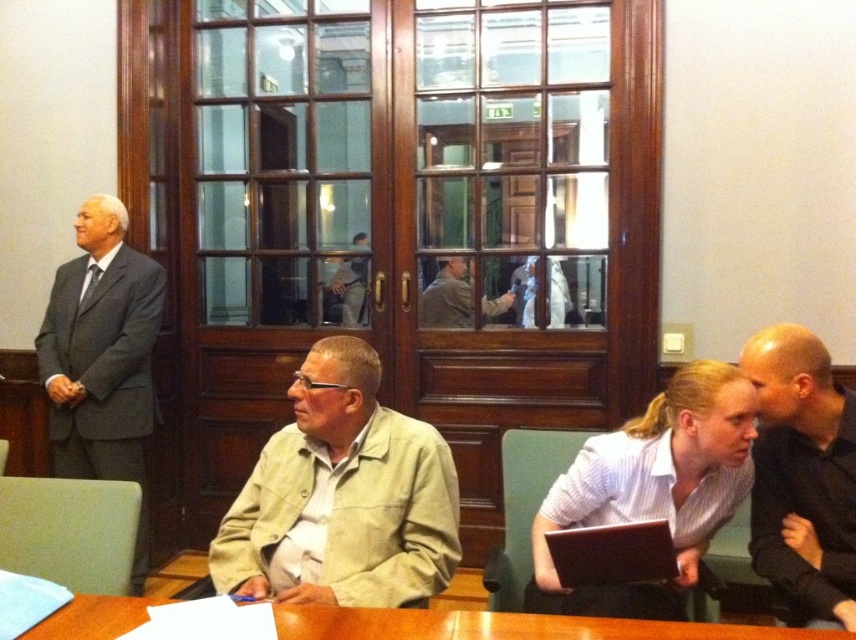
Who is taller, white striped shirt at lower right or black plastic laptop at lower center?

Standing taller between the two is white striped shirt at lower right.

Based on the photo, is white striped shirt at lower right above black plastic laptop at lower center?

Yes.

Based on the photo, measure the distance between white striped shirt at lower right and camera.

white striped shirt at lower right is 5.60 feet away from camera.

Image resolution: width=856 pixels, height=640 pixels. In order to click on white striped shirt at lower right in this screenshot , I will do `click(652, 490)`.

Does white striped shirt at lower right appear under khaki cotton shirt at center?

Correct, white striped shirt at lower right is located below khaki cotton shirt at center.

Is white striped shirt at lower right closer to camera compared to khaki cotton shirt at center?

That is True.

The image size is (856, 640). I want to click on white striped shirt at lower right, so click(x=652, y=490).

Where is `white striped shirt at lower right`? white striped shirt at lower right is located at coordinates (652, 490).

Based on the photo, does brown wooden table at lower center have a smaller size compared to khaki cotton shirt at center?

No, brown wooden table at lower center is not smaller than khaki cotton shirt at center.

Who is positioned more to the right, brown wooden table at lower center or khaki cotton shirt at center?

Positioned to the right is brown wooden table at lower center.

Does point (553, 627) come behind point (345, 308)?

No, it is not.

Locate an element on the screen. brown wooden table at lower center is located at coordinates (504, 627).